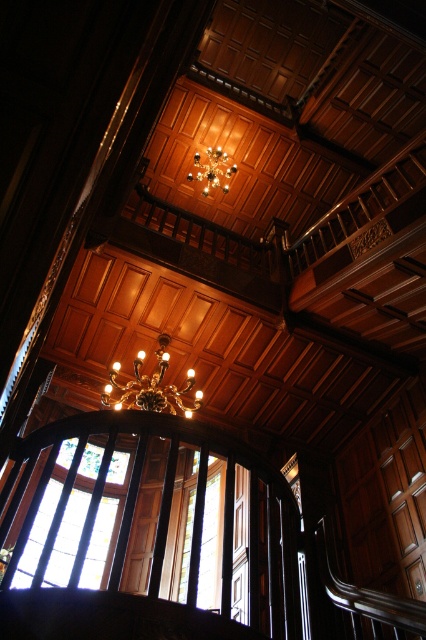
You are an interior designer planning to install a new lighting fixture in the space. You have a choice between a small pendant light and a large chandelier. Considering the existing clear glass window at center and the gold metallic chandelier at center, which existing object would the new large chandelier likely be larger than?

The clear glass window at center has a larger size compared to the gold metallic chandelier at center. Therefore, the new large chandelier would be larger than the gold metallic chandelier at center but still smaller than the clear glass window at center.